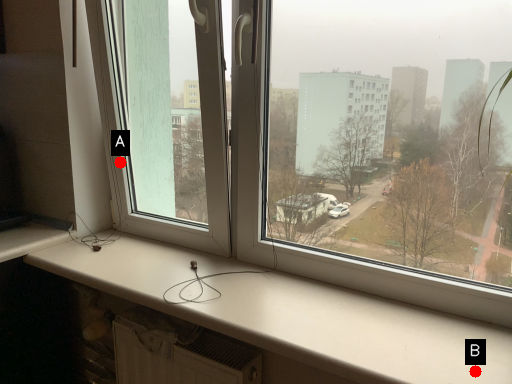
Question: Two points are circled on the image, labeled by A and B beside each circle. Which point is farther to the camera?

Choices:
 (A) A is further
 (B) B is further

Answer: (A)